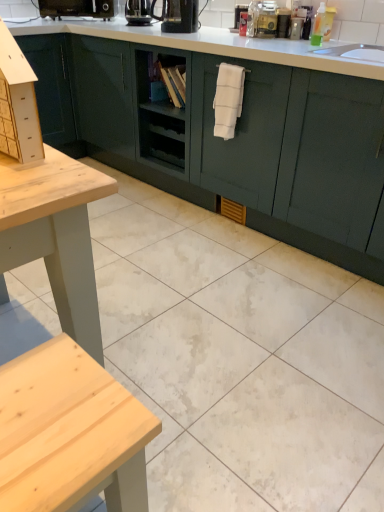
I want to click on black plastic coffee machine at upper center, which ranks as the third coffee machine in back-to-front order, so click(x=178, y=16).

What do you see at coordinates (262, 19) in the screenshot? I see `translucent plastic bottle at upper center` at bounding box center [262, 19].

Locate an element on the screen. The image size is (384, 512). black glossy coffee machine at upper center, acting as the second coffee machine starting from the front is located at coordinates click(x=138, y=12).

Where is `black plastic coffee machine at upper left, arranged as the third coffee machine when viewed from the right`? The height and width of the screenshot is (512, 384). black plastic coffee machine at upper left, arranged as the third coffee machine when viewed from the right is located at coordinates (78, 8).

From a real-world perspective, between black plastic coffee machine at upper center, arranged as the third coffee machine when viewed from the left, and translucent plastic bottle at upper center, who is vertically lower?

From a 3D spatial view, black plastic coffee machine at upper center, arranged as the third coffee machine when viewed from the left, is below.

Is black plastic coffee machine at upper center, arranged as the third coffee machine when viewed from the left, positioned with its back to translucent plastic bottle at upper center?

No, black plastic coffee machine at upper center, arranged as the third coffee machine when viewed from the left, is not facing away from translucent plastic bottle at upper center.

Considering the relative sizes of black plastic coffee machine at upper center, which ranks as the third coffee machine in back-to-front order, and translucent plastic bottle at upper center in the image provided, is black plastic coffee machine at upper center, which ranks as the third coffee machine in back-to-front order, wider than translucent plastic bottle at upper center?

Indeed, black plastic coffee machine at upper center, which ranks as the third coffee machine in back-to-front order, has a greater width compared to translucent plastic bottle at upper center.

Which point is more distant from viewer, (87, 7) or (187, 3)?

The point (87, 7) is more distant.

Does black plastic coffee machine at upper left, marked as the 1th coffee machine in a left-to-right arrangement, have a greater width compared to black plastic coffee machine at upper center, which ranks as the third coffee machine in back-to-front order?

Correct, the width of black plastic coffee machine at upper left, marked as the 1th coffee machine in a left-to-right arrangement, exceeds that of black plastic coffee machine at upper center, which ranks as the third coffee machine in back-to-front order.

Where is `coffee machine that is the 2nd one when counting leftward from the black plastic coffee machine at upper center, the first coffee machine from the right`? The width and height of the screenshot is (384, 512). coffee machine that is the 2nd one when counting leftward from the black plastic coffee machine at upper center, the first coffee machine from the right is located at coordinates click(78, 8).

Between black plastic coffee machine at upper left, which is counted as the first coffee machine, starting from the back, and black plastic coffee machine at upper center, which ranks as the third coffee machine in back-to-front order, which one has smaller size?

With smaller size is black plastic coffee machine at upper center, which ranks as the third coffee machine in back-to-front order.

Is point (206, 452) closer to camera compared to point (249, 8)?

Yes, point (206, 452) is in front of point (249, 8).

From a real-world perspective, is white glossy tile at center physically located above or below translucent plastic bottle at upper center?

white glossy tile at center is below translucent plastic bottle at upper center.

From the image's perspective, is white glossy tile at center over translucent plastic bottle at upper center?

Actually, white glossy tile at center appears below translucent plastic bottle at upper center in the image.

Is the depth of white glossy tile at center greater than that of translucent plastic bottle at upper center?

No.

Is translucent plastic bottle at upper center inside the boundaries of translucent plastic bottle at upper right, or outside?

translucent plastic bottle at upper center is spatially situated outside translucent plastic bottle at upper right.

Considering the sizes of translucent plastic bottle at upper center and translucent plastic bottle at upper right in the image, is translucent plastic bottle at upper center taller or shorter than translucent plastic bottle at upper right?

In the image, translucent plastic bottle at upper center appears to be taller than translucent plastic bottle at upper right.

Would you say translucent plastic bottle at upper center is a long distance from translucent plastic bottle at upper right?

No, there isn't a large distance between translucent plastic bottle at upper center and translucent plastic bottle at upper right.

Identify the location of toiletry below the translucent plastic bottle at upper center (from the image's perspective). Image resolution: width=384 pixels, height=512 pixels. (318, 26).

Is white glossy tile at center positioned beyond the bounds of black glossy coffee machine at upper center, acting as the 2th coffee machine starting from the right?

Indeed, white glossy tile at center is completely outside black glossy coffee machine at upper center, acting as the 2th coffee machine starting from the right.

Considering the relative sizes of white glossy tile at center and black glossy coffee machine at upper center, acting as the 2th coffee machine starting from the right, in the image provided, is white glossy tile at center thinner than black glossy coffee machine at upper center, acting as the 2th coffee machine starting from the right,?

No, white glossy tile at center is not thinner than black glossy coffee machine at upper center, acting as the 2th coffee machine starting from the right.

Does white glossy tile at center have a smaller size compared to black glossy coffee machine at upper center, placed as the second coffee machine when sorted from left to right?

→ No.

Considering the positions of points (269, 13) and (194, 2), is point (269, 13) farther from camera compared to point (194, 2)?

No, (269, 13) is closer to viewer.

What's the angular difference between translucent plastic bottle at upper center and black plastic coffee machine at upper center, which ranks as the 1th coffee machine in front-to-back order,'s facing directions?

They differ by 3.95 degrees in their facing directions.

Locate an element on the screen. The image size is (384, 512). appliance lying on the right of black plastic coffee machine at upper center, arranged as the third coffee machine when viewed from the left is located at coordinates tap(262, 19).

Is translucent plastic bottle at upper center positioned with its back to black plastic coffee machine at upper center, the first coffee machine from the right?

translucent plastic bottle at upper center is not turned away from black plastic coffee machine at upper center, the first coffee machine from the right.

Can translucent plastic bottle at upper right be found inside black plastic coffee machine at upper left, arranged as the third coffee machine when viewed from the right?

No, translucent plastic bottle at upper right is located outside of black plastic coffee machine at upper left, arranged as the third coffee machine when viewed from the right.

Considering the sizes of objects black plastic coffee machine at upper left, arranged as the third coffee machine when viewed from the right, and translucent plastic bottle at upper right in the image provided, who is shorter, black plastic coffee machine at upper left, arranged as the third coffee machine when viewed from the right, or translucent plastic bottle at upper right?

Standing shorter between the two is black plastic coffee machine at upper left, arranged as the third coffee machine when viewed from the right.

Is black plastic coffee machine at upper left, which is counted as the first coffee machine, starting from the back, positioned with its back to translucent plastic bottle at upper right?

No, translucent plastic bottle at upper right is not at the back of black plastic coffee machine at upper left, which is counted as the first coffee machine, starting from the back.

Is the surface of black plastic coffee machine at upper left, which is counted as the first coffee machine, starting from the back, in direct contact with translucent plastic bottle at upper right?

black plastic coffee machine at upper left, which is counted as the first coffee machine, starting from the back, and translucent plastic bottle at upper right are clearly separated.

Identify the location of the 1st coffee machine to the left of the translucent plastic bottle at upper center, counting from the anchor's position. (178, 16).

I want to click on the 2nd coffee machine below the black plastic coffee machine at upper left, the third coffee machine when ordered from front to back (from the image's perspective), so click(178, 16).

Which object lies further to the anchor point translucent plastic bottle at upper center, black glossy coffee machine at upper center, acting as the second coffee machine starting from the front, or black plastic coffee machine at upper center, which ranks as the 1th coffee machine in front-to-back order?

Among the two, black glossy coffee machine at upper center, acting as the second coffee machine starting from the front, is located further to translucent plastic bottle at upper center.

Looking at the image, which one is located further to black plastic coffee machine at upper center, which ranks as the third coffee machine in back-to-front order, black plastic coffee machine at upper left, marked as the 1th coffee machine in a left-to-right arrangement, or translucent plastic bottle at upper center?

Based on the image, black plastic coffee machine at upper left, marked as the 1th coffee machine in a left-to-right arrangement, appears to be further to black plastic coffee machine at upper center, which ranks as the third coffee machine in back-to-front order.

When comparing their distances from black plastic coffee machine at upper center, arranged as the third coffee machine when viewed from the left, does black glossy coffee machine at upper center, which is the 2th coffee machine in back-to-front order, or translucent plastic bottle at upper right seem closer?

black glossy coffee machine at upper center, which is the 2th coffee machine in back-to-front order, lies closer to black plastic coffee machine at upper center, arranged as the third coffee machine when viewed from the left, than the other object.

From the image, which object appears to be farther from black glossy coffee machine at upper center, which is the 2th coffee machine in back-to-front order, black plastic coffee machine at upper center, the first coffee machine from the right, or black plastic coffee machine at upper left, arranged as the third coffee machine when viewed from the right?

The object further to black glossy coffee machine at upper center, which is the 2th coffee machine in back-to-front order, is black plastic coffee machine at upper left, arranged as the third coffee machine when viewed from the right.

Based on their spatial positions, is black plastic coffee machine at upper center, the first coffee machine from the right, or translucent plastic bottle at upper right further from white glossy tile at center?

Among the two, black plastic coffee machine at upper center, the first coffee machine from the right, is located further to white glossy tile at center.

Which object lies nearer to the anchor point black plastic coffee machine at upper center, which ranks as the 1th coffee machine in front-to-back order, translucent plastic bottle at upper center or black glossy coffee machine at upper center, acting as the second coffee machine starting from the front?

black glossy coffee machine at upper center, acting as the second coffee machine starting from the front, lies closer to black plastic coffee machine at upper center, which ranks as the 1th coffee machine in front-to-back order, than the other object.

Which object lies nearer to the anchor point black plastic coffee machine at upper left, the third coffee machine when ordered from front to back, translucent plastic bottle at upper center or translucent plastic bottle at upper right?

translucent plastic bottle at upper center.

Consider the image. Considering their positions, is black plastic coffee machine at upper center, which ranks as the 1th coffee machine in front-to-back order, positioned further to black plastic coffee machine at upper left, which is counted as the first coffee machine, starting from the back, than black glossy coffee machine at upper center, placed as the second coffee machine when sorted from left to right?

The object further to black plastic coffee machine at upper left, which is counted as the first coffee machine, starting from the back, is black plastic coffee machine at upper center, which ranks as the 1th coffee machine in front-to-back order.

The image size is (384, 512). What are the coordinates of `appliance situated between black plastic coffee machine at upper center, which ranks as the third coffee machine in back-to-front order, and translucent plastic bottle at upper right from left to right` in the screenshot? It's located at (262, 19).

I want to click on toiletry located between white glossy tile at center and translucent plastic bottle at upper center in the depth direction, so click(318, 26).

The width and height of the screenshot is (384, 512). Identify the location of appliance between white glossy tile at center and black plastic coffee machine at upper center, the first coffee machine from the right, from front to back. (262, 19).

Where is `toiletry between white glossy tile at center and black plastic coffee machine at upper left, arranged as the third coffee machine when viewed from the right, in the front-back direction`? Image resolution: width=384 pixels, height=512 pixels. toiletry between white glossy tile at center and black plastic coffee machine at upper left, arranged as the third coffee machine when viewed from the right, in the front-back direction is located at coordinates (318, 26).